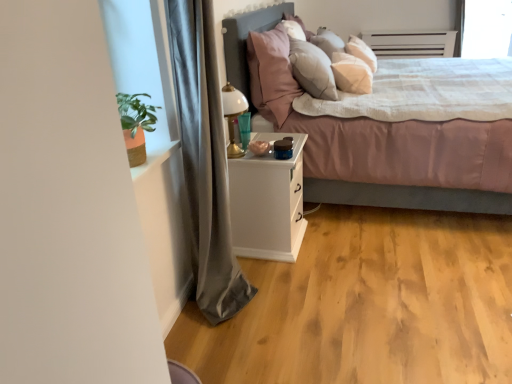
Question: Looking at their shapes, would you say gray fabric curtain at left is wider or thinner than pink plush pillow at upper center?

Choices:
 (A) thin
 (B) wide

Answer: (A)

Question: From the image's perspective, is gray fabric curtain at left located above or below pink plush pillow at upper center?

Choices:
 (A) below
 (B) above

Answer: (A)

Question: Which is farther from the matte pink fabric bed at center?

Choices:
 (A) white matte nightstand at center
 (B) gold metallic table lamp at center
 (C) transparent glass window screen at upper right
 (D) gray fabric curtain at left
 (E) pink plush pillow at upper center

Answer: (C)

Question: Which object is positioned closest to the white matte nightstand at center?

Choices:
 (A) matte pink fabric bed at center
 (B) pink plush pillow at upper center
 (C) gray fabric curtain at left
 (D) transparent glass window screen at upper right
 (E) gold metallic table lamp at center

Answer: (E)